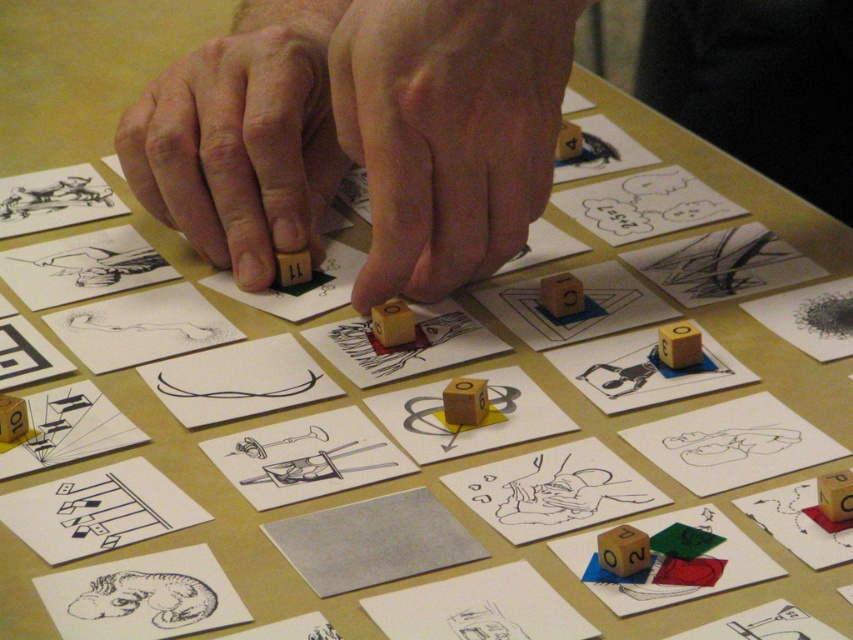
Question: Can you confirm if wooden at center is bigger than black textured dinosaur at bottom left?

Choices:
 (A) yes
 (B) no

Answer: (A)

Question: Does wooden block at center have a smaller size compared to black textured dinosaur at bottom left?

Choices:
 (A) no
 (B) yes

Answer: (A)

Question: Based on their relative distances, which object is nearer to the wooden at center?

Choices:
 (A) wooden block at center
 (B) black textured dinosaur at bottom left

Answer: (A)

Question: Does wooden at center appear under wooden block at center?

Choices:
 (A) yes
 (B) no

Answer: (A)

Question: Which of the following is the closest to the observer?

Choices:
 (A) (490, 8)
 (B) (335, 20)

Answer: (A)

Question: Which object is closer to the camera taking this photo?

Choices:
 (A) wooden block at center
 (B) black textured dinosaur at bottom left
 (C) wooden at center

Answer: (B)